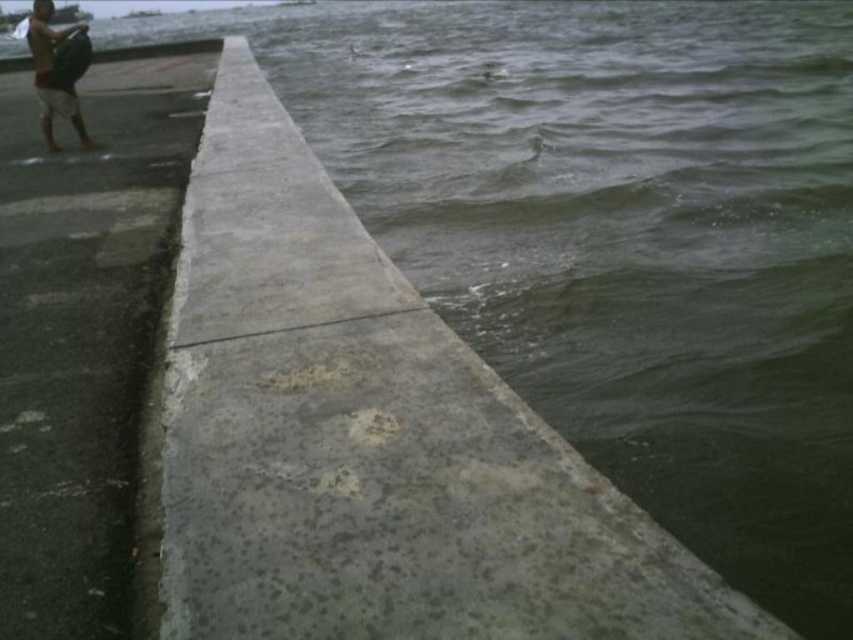
You are standing on the gray concrete pavement at left and want to reach the tan skin human at upper left. Which direction should you move to get closer to them?

Since the gray concrete pavement at left is closer to the viewer than the tan skin human at upper left, you should move towards the upper left direction to get closer to them.

You are standing on the concrete structure looking towards the water. There are two points marked on the image. Which point, point (659,564) or point (123,257), is closer to you?

Point (659,564) is closer to you than point (123,257).

You are standing on the concrete structure and notice a specific point marked at coordinates (370, 440). What material is located at this point?

The point at coordinates (370, 440) corresponds to gray concrete at center.